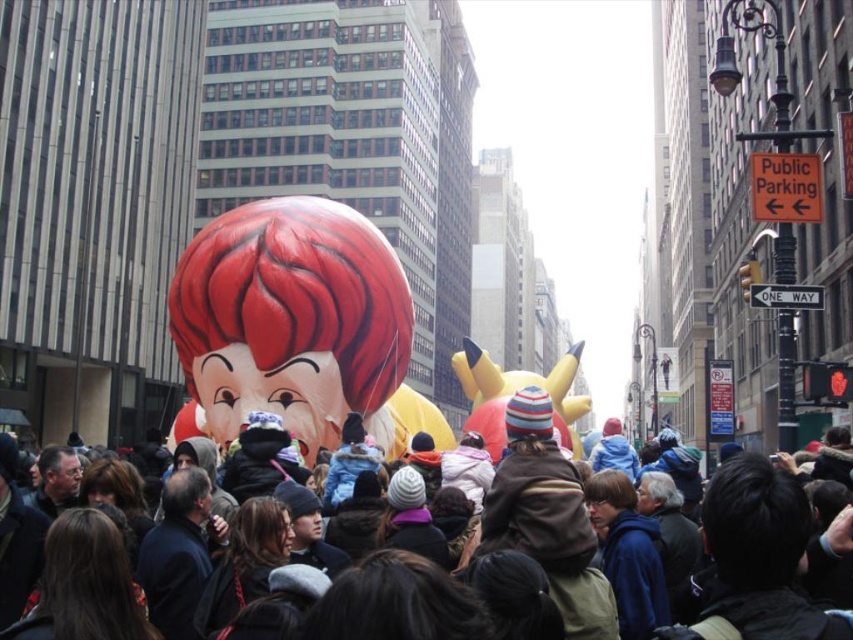
Question: Based on their relative distances, which object is farther from the matte red balloon at center?

Choices:
 (A) yellow matte balloon at center
 (B) shiny red balloon at center

Answer: (B)

Question: Which object is the closest to the matte red balloon at center?

Choices:
 (A) yellow matte balloon at center
 (B) shiny red balloon at center

Answer: (A)

Question: Does shiny red balloon at center have a larger size compared to matte red balloon at center?

Choices:
 (A) yes
 (B) no

Answer: (B)

Question: Estimate the real-world distances between objects in this image. Which object is farther from the shiny red balloon at center?

Choices:
 (A) yellow matte balloon at center
 (B) matte red balloon at center

Answer: (B)

Question: From the image, what is the correct spatial relationship of shiny red balloon at center in relation to matte red balloon at center?

Choices:
 (A) left
 (B) right

Answer: (A)

Question: Where is matte red balloon at center located in relation to yellow matte balloon at center in the image?

Choices:
 (A) above
 (B) below

Answer: (A)